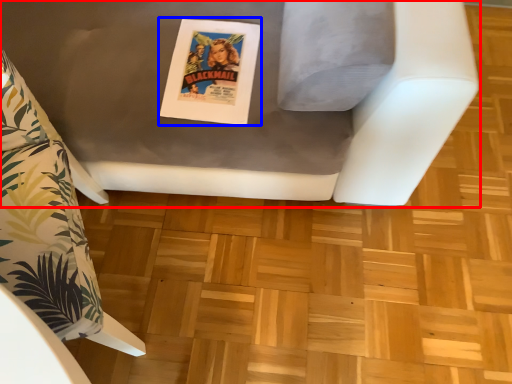
Question: Among these objects, which one is nearest to the camera, furniture (highlighted by a red box) or comic book (highlighted by a blue box)?

Choices:
 (A) furniture
 (B) comic book

Answer: (A)